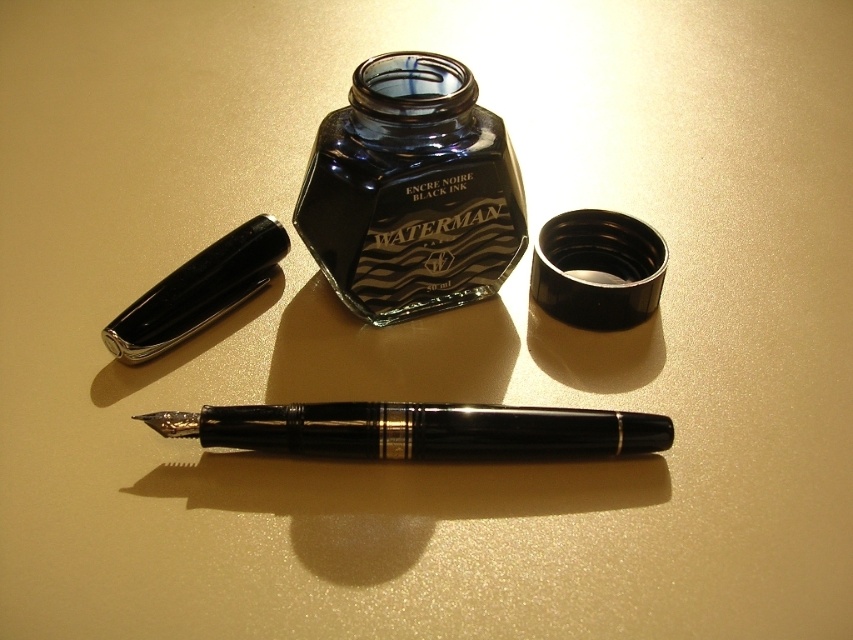
Question: Does black glass bottle at center come behind black polished pen at center?

Choices:
 (A) yes
 (B) no

Answer: (A)

Question: Which object appears farthest from the camera in this image?

Choices:
 (A) black polished pen at center
 (B) glossy black pen at upper left
 (C) black glass bottle at center

Answer: (B)

Question: Which point appears farthest from the camera in this image?

Choices:
 (A) (329, 433)
 (B) (350, 132)

Answer: (B)

Question: Based on their relative distances, which object is nearer to the black glass bottle at center?

Choices:
 (A) glossy black pen at upper left
 (B) black polished pen at center

Answer: (A)

Question: Does black polished pen at center appear on the right side of glossy black pen at upper left?

Choices:
 (A) no
 (B) yes

Answer: (B)

Question: In this image, where is black glass bottle at center located relative to black polished pen at center?

Choices:
 (A) above
 (B) below

Answer: (A)